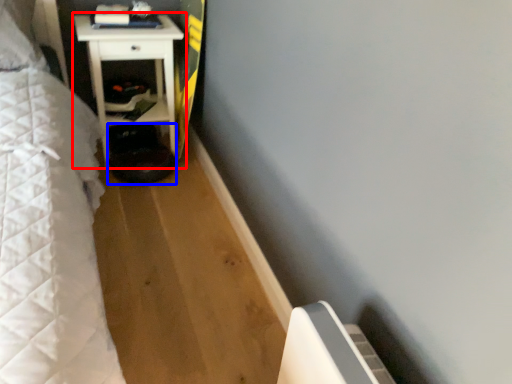
Question: Which of the following is the closest to the observer, furniture (highlighted by a red box) or step stool (highlighted by a blue box)?

Choices:
 (A) furniture
 (B) step stool

Answer: (A)